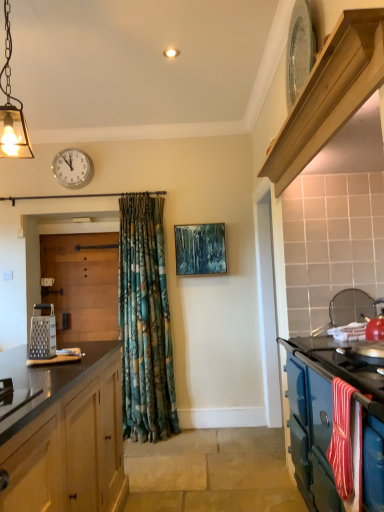
Locate an element on the screen. The height and width of the screenshot is (512, 384). vacant region above wooden door at left (from a real-world perspective) is located at coordinates (76, 234).